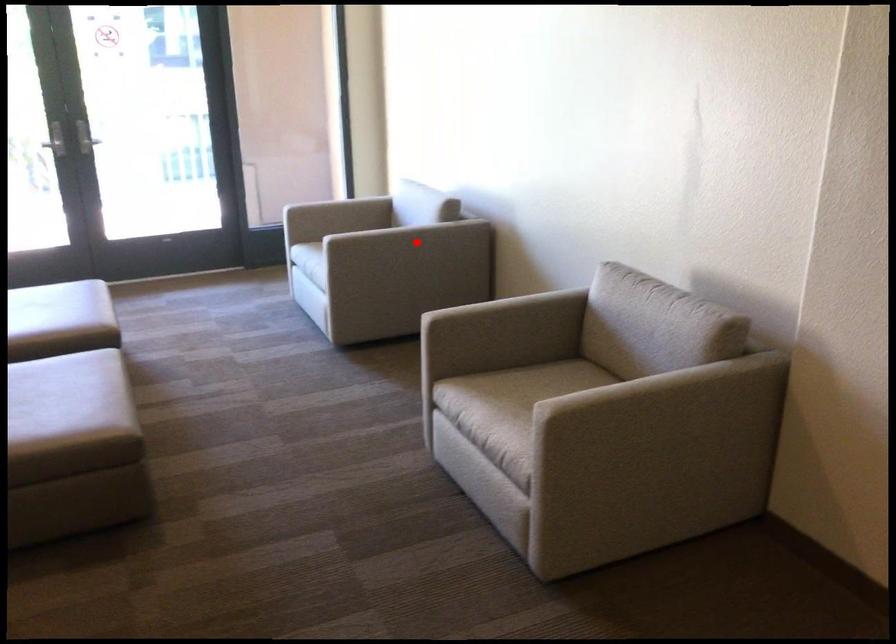
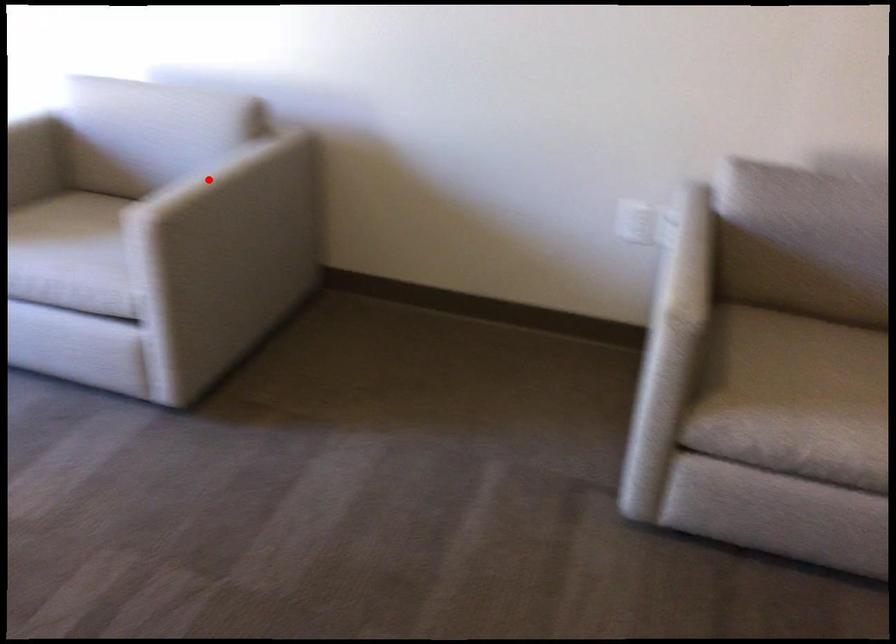
I am providing you with two images of the same scene from different viewpoints. A red point is marked on the first image and another point is marked on the second image. Do the highlighted points in image1 and image2 indicate the same real-world spot?

No